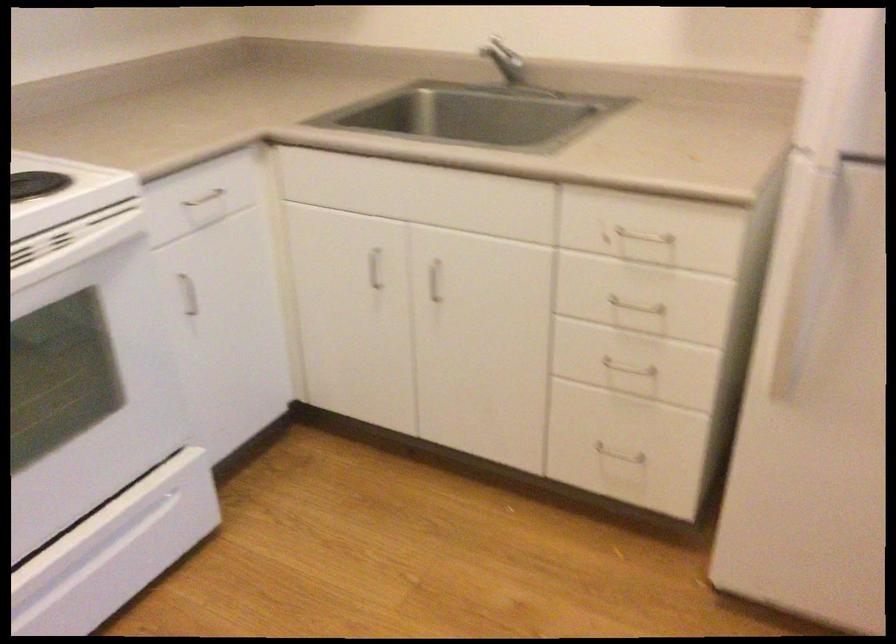
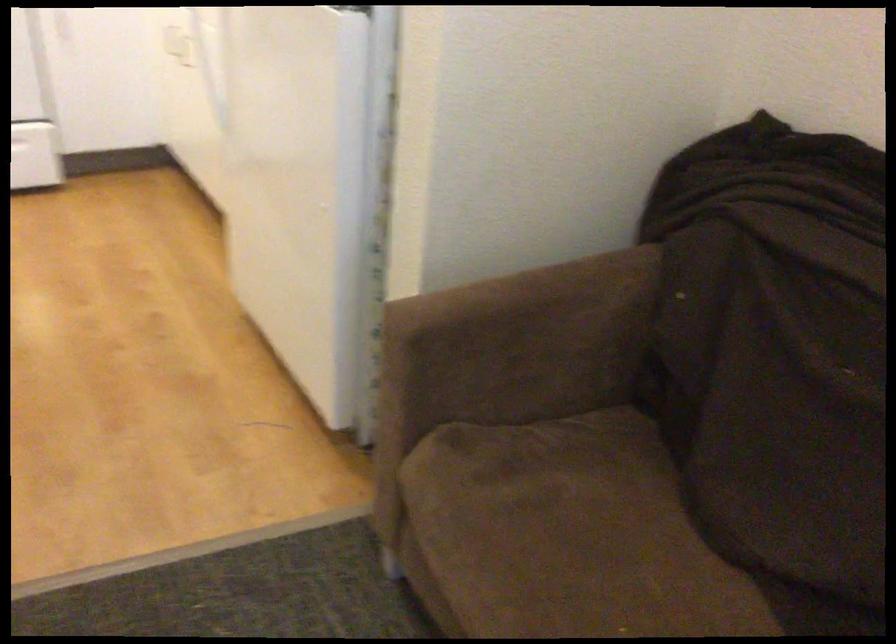
Question: I am providing you with two images of the same scene from different viewpoints. Please identify which objects are invisible in image2.

Choices:
 (A) brown sofa armrest
 (B) upholstered sofa sitting surface
 (C) sofa sitting surface
 (D) metal pull handle

Answer: (D)